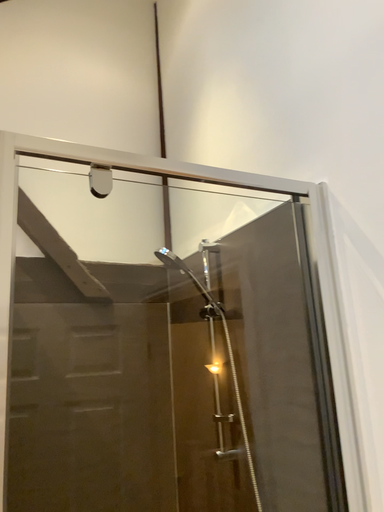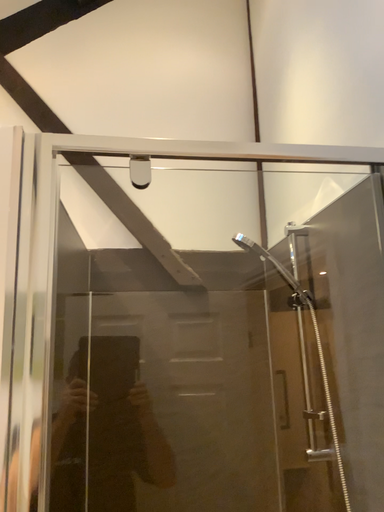
Question: Which way did the camera rotate in the video?

Choices:
 (A) rotated left
 (B) rotated right

Answer: (A)